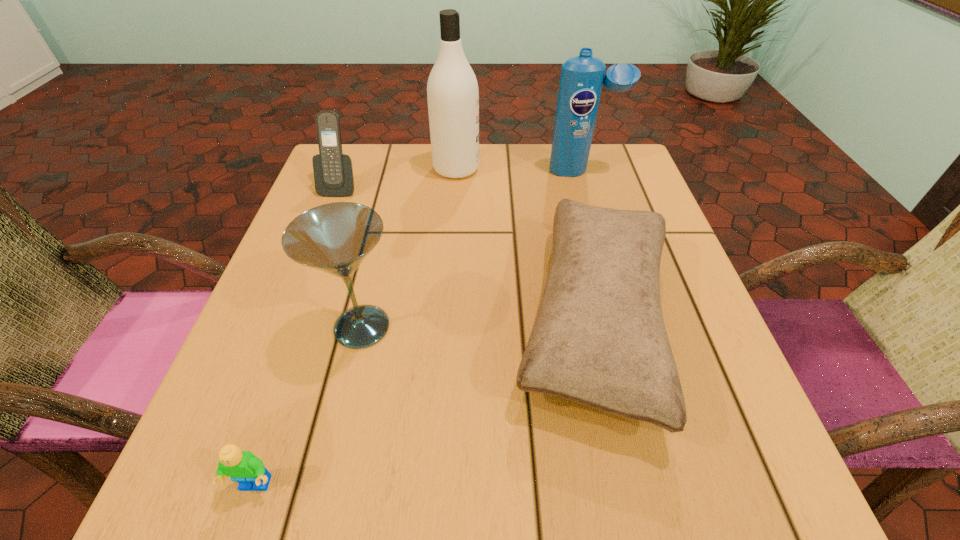
Where is `free space at the far left corner of the desktop`? Image resolution: width=960 pixels, height=540 pixels. free space at the far left corner of the desktop is located at coordinates (381, 183).

Where is `vacant point located between the right shampoo and the nearest object`? The height and width of the screenshot is (540, 960). vacant point located between the right shampoo and the nearest object is located at coordinates (419, 328).

Locate an element on the screen. This screenshot has height=540, width=960. free space between the nearest object and the cushion is located at coordinates [425, 403].

This screenshot has height=540, width=960. I want to click on free space between the fourth shortest object and the shortest object, so click(x=309, y=407).

The image size is (960, 540). Find the location of `vacant region between the shortest object and the right shampoo`. vacant region between the shortest object and the right shampoo is located at coordinates (419, 328).

This screenshot has height=540, width=960. I want to click on vacant region between the third shortest object and the shorter shampoo, so 461,179.

Find the location of a particular element. The image size is (960, 540). vacant area that lies between the third shortest object and the taller shampoo is located at coordinates (398, 178).

The image size is (960, 540). I want to click on free area in between the fourth tallest object and the second tallest object, so click(x=461, y=179).

Find the location of `object that stands as the third closest to the shortest object`. object that stands as the third closest to the shortest object is located at coordinates (x=333, y=171).

Select which object appears as the third closest to the left shampoo. Please provide its 2D coordinates. Your answer should be formatted as a tuple, i.e. [(x, y)], where the tuple contains the x and y coordinates of a point satisfying the conditions above.

[(599, 339)]